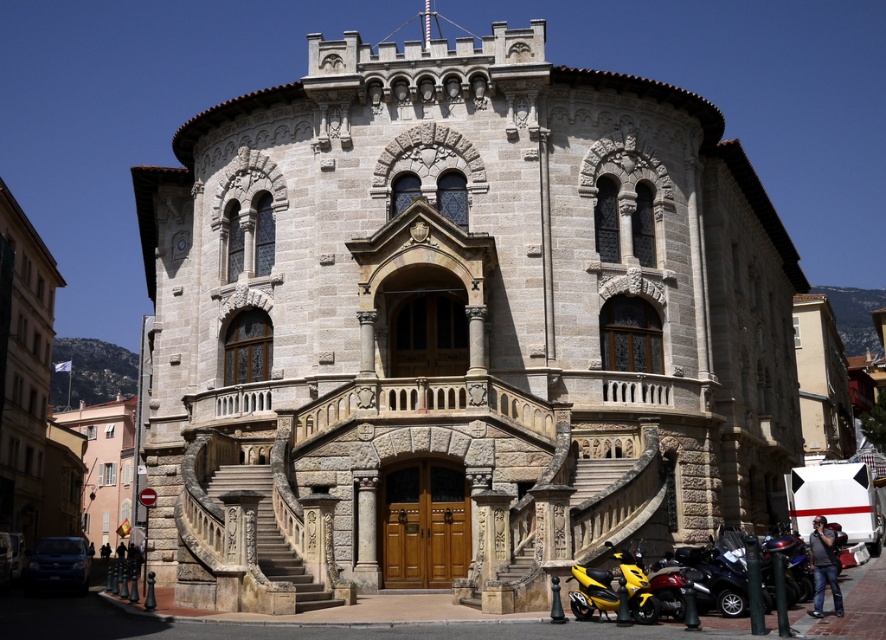
Does point (447, 179) come closer to viewer compared to point (231, 474)?

No.

Is stone textured church at center below stone textured stairs at center?

Actually, stone textured church at center is above stone textured stairs at center.

What are the coordinates of `stone textured church at center` in the screenshot? It's located at (456, 326).

What are the coordinates of `stone textured church at center` in the screenshot? It's located at tap(456, 326).

Measure the distance between stone textured stairs at center and yellow matte scooter at lower right.

14.83 meters

Is stone textured stairs at center closer to camera compared to yellow matte scooter at lower right?

No, stone textured stairs at center is behind yellow matte scooter at lower right.

What do you see at coordinates (271, 534) in the screenshot? I see `stone textured stairs at center` at bounding box center [271, 534].

Where is `stone textured stairs at center`? stone textured stairs at center is located at coordinates (271, 534).

Is the position of stone textured church at center more distant than that of yellow matte scooter at lower right?

Yes, stone textured church at center is further from the viewer.

Measure the distance between stone textured church at center and camera.

They are 38.99 meters apart.

Identify the location of stone textured church at center. Image resolution: width=886 pixels, height=640 pixels. (456, 326).